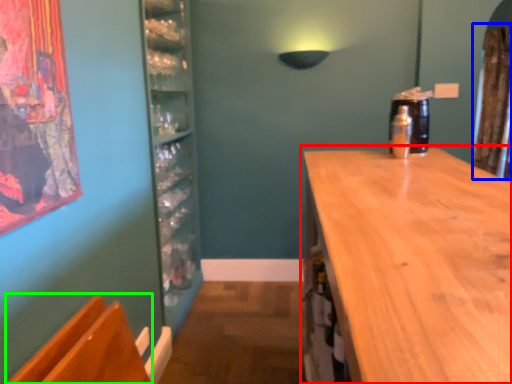
Question: Which object is positioned farthest from countertop (highlighted by a red box)? Select from curtain (highlighted by a blue box) and armchair (highlighted by a green box).

Choices:
 (A) curtain
 (B) armchair

Answer: (A)